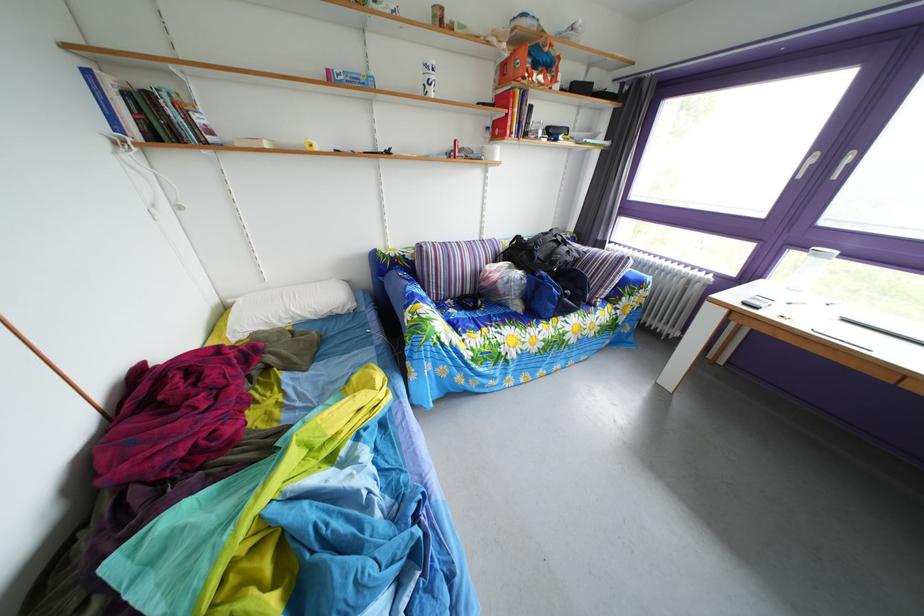
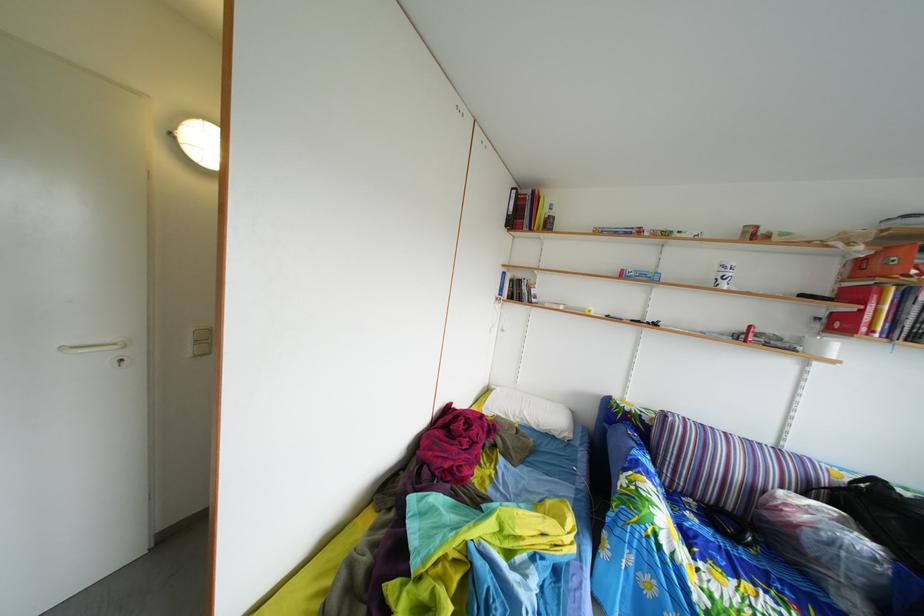
In the second image, find the point that corresponds to [529,261] in the first image.

(886, 515)